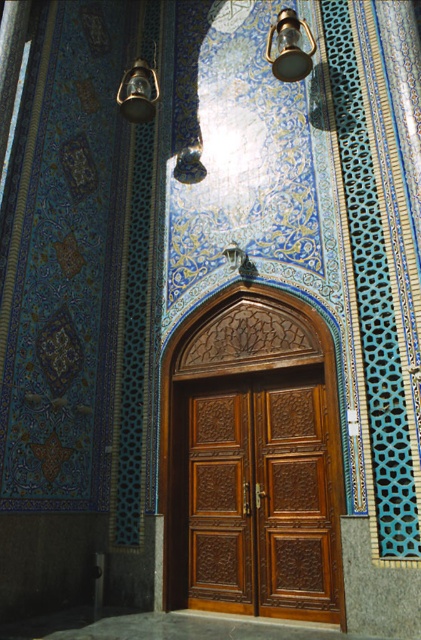
Question: Based on their relative distances, which object is farther from the metallic brass lantern at upper left?

Choices:
 (A) metallic glass at upper center
 (B) brown carved wood door at center

Answer: (B)

Question: Which point appears farthest from the camera in this image?

Choices:
 (A) (136, 97)
 (B) (271, 476)
 (C) (290, 32)

Answer: (A)

Question: Does brown carved wood door at center appear under metallic glass at upper center?

Choices:
 (A) yes
 (B) no

Answer: (A)

Question: Does brown carved wood door at center have a greater width compared to metallic brass lantern at upper left?

Choices:
 (A) yes
 (B) no

Answer: (A)

Question: Can you confirm if metallic glass at upper center is positioned to the left of metallic brass lantern at upper left?

Choices:
 (A) yes
 (B) no

Answer: (B)

Question: Which of the following is the closest to the observer?

Choices:
 (A) (220, 380)
 (B) (125, 109)
 (C) (288, 10)

Answer: (C)